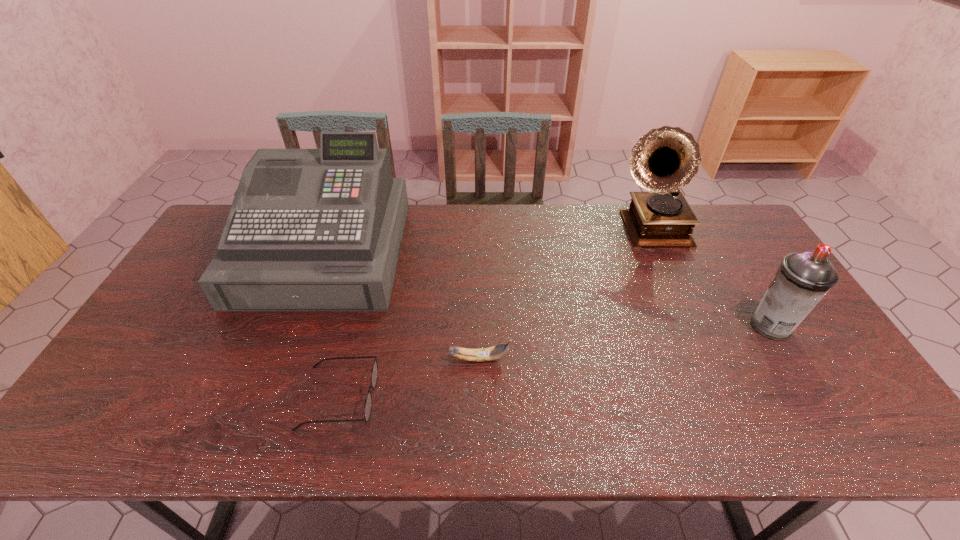
The image size is (960, 540). Find the location of `record player`. record player is located at coordinates (665, 159).

The width and height of the screenshot is (960, 540). Find the location of `cash register`. cash register is located at coordinates 321,229.

Where is `the rightmost object`? the rightmost object is located at coordinates (803, 279).

Find the location of a particular element. This screenshot has height=540, width=960. the third tallest object is located at coordinates (803, 279).

The image size is (960, 540). I want to click on the third object from left to right, so click(x=490, y=353).

At what (x,y) coordinates should I click in order to perform the action: click on banana. Please return your answer as a coordinate pair (x, y). Looking at the image, I should click on (490, 353).

Image resolution: width=960 pixels, height=540 pixels. I want to click on spectacles, so coord(374,373).

This screenshot has height=540, width=960. What are the coordinates of `the shortest object` in the screenshot? It's located at (374, 373).

Where is `vacant space located on the horn of the fourth object from left to right`? Image resolution: width=960 pixels, height=540 pixels. vacant space located on the horn of the fourth object from left to right is located at coordinates (708, 359).

Find the location of `vacant space located on the front-facing side of the cash register`. vacant space located on the front-facing side of the cash register is located at coordinates (272, 388).